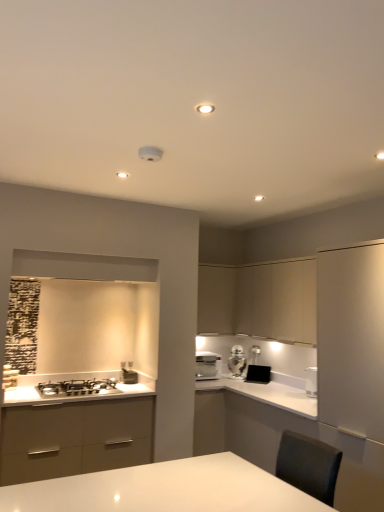
Question: Does matte beige cabinet at upper center, the first cabinetry from the left, have a greater width compared to black matte toaster at center, the second appliance from the left?

Choices:
 (A) yes
 (B) no

Answer: (A)

Question: From a real-world perspective, is matte beige cabinet at upper center, which is counted as the 2th cabinetry, starting from the right, positioned over black matte toaster at center, the 1th appliance in the back-to-front sequence, based on gravity?

Choices:
 (A) no
 (B) yes

Answer: (B)

Question: Is the depth of matte beige cabinet at upper center, the first cabinetry from the left, less than that of black matte toaster at center, the 1th appliance in the back-to-front sequence?

Choices:
 (A) yes
 (B) no

Answer: (B)

Question: Is matte beige cabinet at upper center, which is counted as the 2th cabinetry, starting from the right, next to black matte toaster at center, the second appliance from the left, and touching it?

Choices:
 (A) yes
 (B) no

Answer: (B)

Question: Does matte beige cabinet at upper center, which is counted as the 2th cabinetry, starting from the right, contain black matte toaster at center, the 1th appliance when ordered from right to left?

Choices:
 (A) no
 (B) yes

Answer: (A)

Question: Is matte beige cabinet at upper center, the first cabinetry from the left, not close to black matte toaster at center, the 2th appliance when ordered from front to back?

Choices:
 (A) yes
 (B) no

Answer: (B)

Question: From the image's perspective, is metallic silver toaster at lower center, which is counted as the second appliance, starting from the back, located beneath white glossy countertop at center?

Choices:
 (A) yes
 (B) no

Answer: (B)

Question: Is metallic silver toaster at lower center, which ranks as the first appliance in left-to-right order, positioned behind white glossy countertop at center?

Choices:
 (A) yes
 (B) no

Answer: (A)

Question: Could you tell me if metallic silver toaster at lower center, arranged as the 1th appliance when viewed from the front, is turned towards white glossy countertop at center?

Choices:
 (A) no
 (B) yes

Answer: (A)

Question: Is metallic silver toaster at lower center, arranged as the 1th appliance when viewed from the front, to the right of white glossy countertop at center from the viewer's perspective?

Choices:
 (A) no
 (B) yes

Answer: (B)

Question: Is white glossy countertop at center at the back of metallic silver toaster at lower center, which ranks as the first appliance in left-to-right order?

Choices:
 (A) yes
 (B) no

Answer: (B)

Question: Is metallic silver toaster at lower center, which ranks as the first appliance in left-to-right order, taller than white glossy countertop at center?

Choices:
 (A) no
 (B) yes

Answer: (A)

Question: Is satin silver gas stove at lower left positioned before matte beige cabinet at upper center, which is counted as the 2th cabinetry, starting from the right?

Choices:
 (A) no
 (B) yes

Answer: (B)